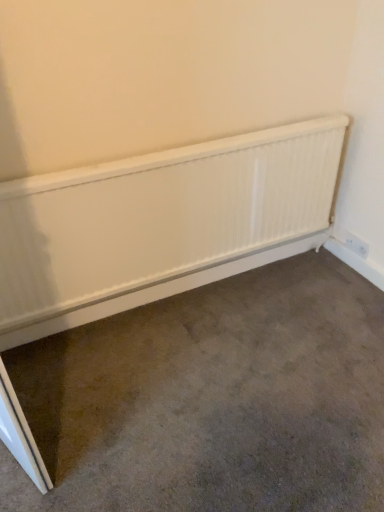
Question: From the image's perspective, is white matte radiator at center on top of white plastic electric outlet at lower right?

Choices:
 (A) yes
 (B) no

Answer: (B)

Question: Does white matte radiator at center have a lesser height compared to white plastic electric outlet at lower right?

Choices:
 (A) no
 (B) yes

Answer: (B)

Question: Does white matte radiator at center have a greater height compared to white plastic electric outlet at lower right?

Choices:
 (A) yes
 (B) no

Answer: (B)

Question: From a real-world perspective, is white matte radiator at center beneath white plastic electric outlet at lower right?

Choices:
 (A) yes
 (B) no

Answer: (A)

Question: From a real-world perspective, is white matte radiator at center on top of white plastic electric outlet at lower right?

Choices:
 (A) yes
 (B) no

Answer: (B)

Question: Is white matte radiator at center not near white plastic electric outlet at lower right?

Choices:
 (A) yes
 (B) no

Answer: (A)

Question: Does white textured radiator at center have a smaller size compared to white plastic electric outlet at lower right?

Choices:
 (A) yes
 (B) no

Answer: (B)

Question: Is white textured radiator at center wider than white plastic electric outlet at lower right?

Choices:
 (A) yes
 (B) no

Answer: (A)

Question: Is white plastic electric outlet at lower right inside white textured radiator at center?

Choices:
 (A) yes
 (B) no

Answer: (B)

Question: Is white textured radiator at center not close to white plastic electric outlet at lower right?

Choices:
 (A) no
 (B) yes

Answer: (A)

Question: From a real-world perspective, does white textured radiator at center sit lower than white plastic electric outlet at lower right?

Choices:
 (A) yes
 (B) no

Answer: (B)

Question: Does white textured radiator at center appear on the left side of white plastic electric outlet at lower right?

Choices:
 (A) no
 (B) yes

Answer: (B)

Question: Does white plastic electric outlet at lower right have a smaller size compared to white matte radiator at center?

Choices:
 (A) yes
 (B) no

Answer: (A)